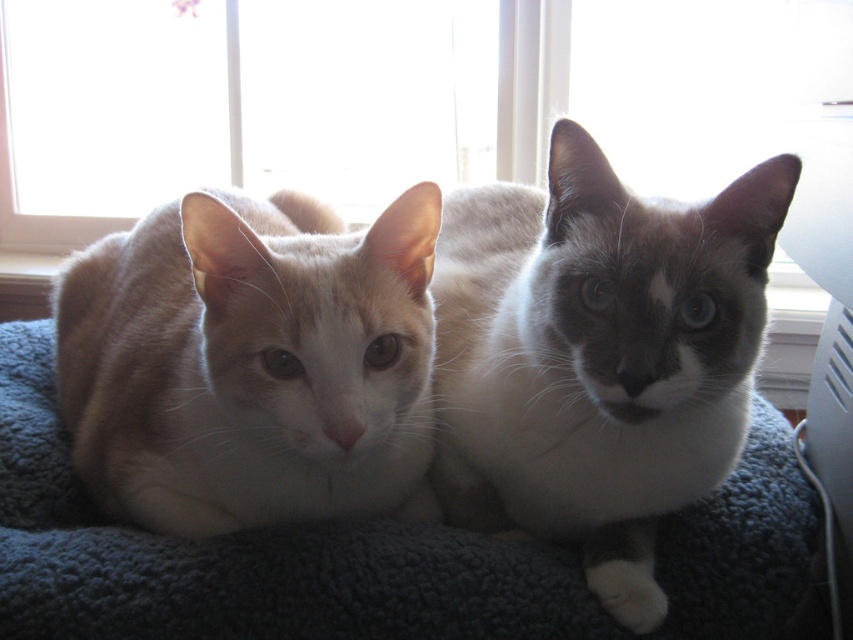
Which of these two, silky white cat at center or matte white cat at left, stands shorter?

Standing shorter between the two is matte white cat at left.

Can you confirm if silky white cat at center is smaller than matte white cat at left?

Indeed, silky white cat at center has a smaller size compared to matte white cat at left.

Is point (460, 436) positioned in front of point (379, 227)?

No, it is behind (379, 227).

At what (x,y) coordinates should I click in order to perform the action: click on silky white cat at center. Please return your answer as a coordinate pair (x, y). Looking at the image, I should click on (596, 356).

Measure the distance between matte white cat at left and dark blue fleece at center.

The distance of matte white cat at left from dark blue fleece at center is 6.66 inches.

Which is more to the right, matte white cat at left or dark blue fleece at center?

Positioned to the right is dark blue fleece at center.

This screenshot has width=853, height=640. Identify the location of matte white cat at left. (251, 362).

Between silky white cat at center and transparent glass window at upper center, which one has less height?

With less height is silky white cat at center.

Image resolution: width=853 pixels, height=640 pixels. Describe the element at coordinates (596, 356) in the screenshot. I see `silky white cat at center` at that location.

Is point (601, 276) closer to viewer compared to point (79, 230)?

Yes, point (601, 276) is in front of point (79, 230).

Where is `silky white cat at center`? silky white cat at center is located at coordinates (596, 356).